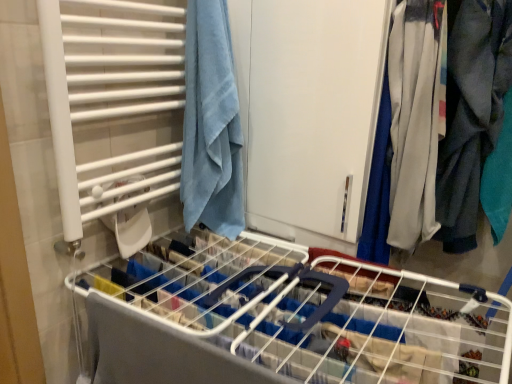
Question: From a real-world perspective, is white plastic bed frame at center positioned above or below gray cotton pants at right?

Choices:
 (A) above
 (B) below

Answer: (B)

Question: Considering the positions of white plastic bed frame at center and gray cotton pants at right in the image, is white plastic bed frame at center wider or thinner than gray cotton pants at right?

Choices:
 (A) thin
 (B) wide

Answer: (B)

Question: Considering the real-world distances, which object is closest to the white plastic bed frame at center?

Choices:
 (A) blue cotton towel at upper left
 (B) gray cotton pants at right
 (C) white matte cabinet at center

Answer: (A)

Question: Which object is positioned closest to the white matte cabinet at center?

Choices:
 (A) blue cotton towel at upper left
 (B) white plastic bed frame at center
 (C) gray cotton pants at right

Answer: (A)